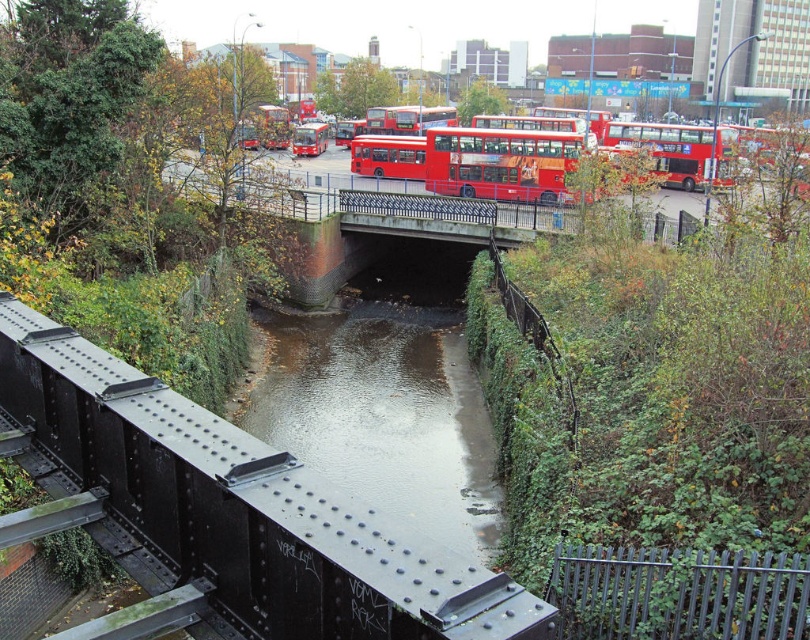
Measure the distance from red matte double-decker bus at center to matte red bus at center.

red matte double-decker bus at center and matte red bus at center are 35.05 meters apart.

Who is higher up, red matte double-decker bus at center or matte red bus at center?

Positioned higher is matte red bus at center.

Who is more forward, (475, 189) or (303, 140)?

Point (475, 189) is in front.

Where is `red matte double-decker bus at center`? red matte double-decker bus at center is located at coordinates (502, 163).